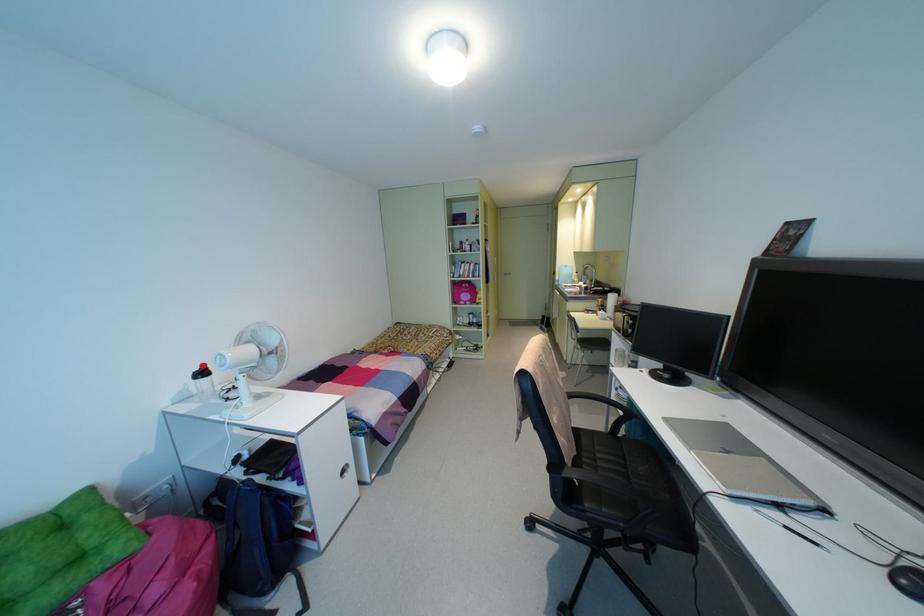
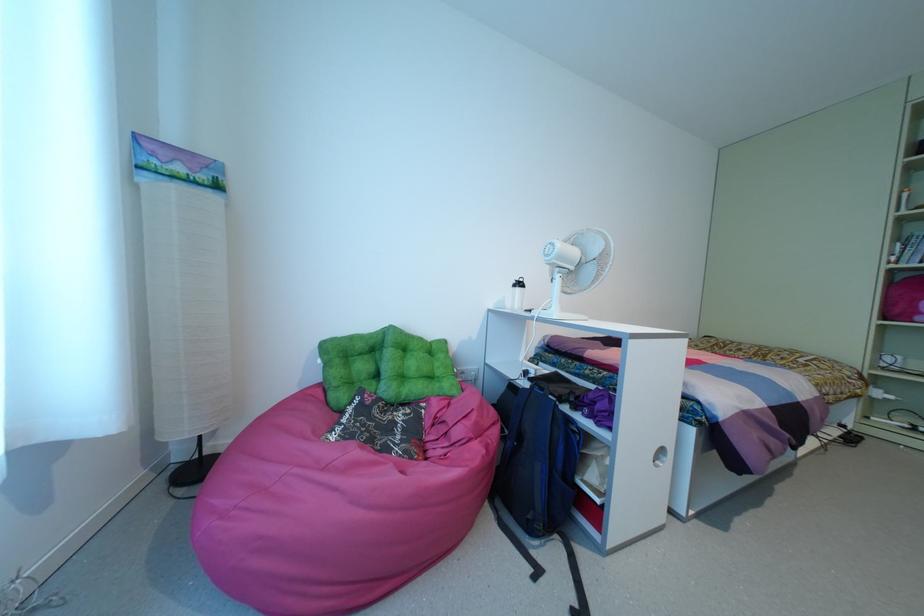
Find the pixel in the second image that matches the highlighted location in the first image.

(520, 280)